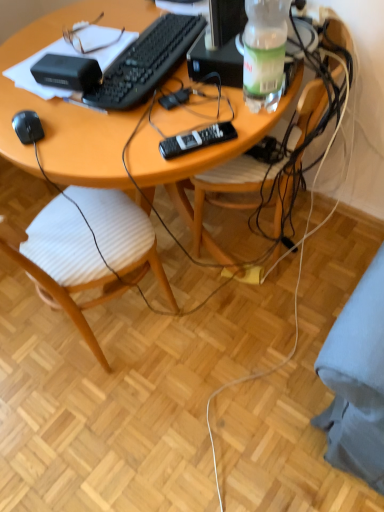
In order to click on vacant space in front of black matte computer mouse at lower left in this screenshot , I will do `click(48, 155)`.